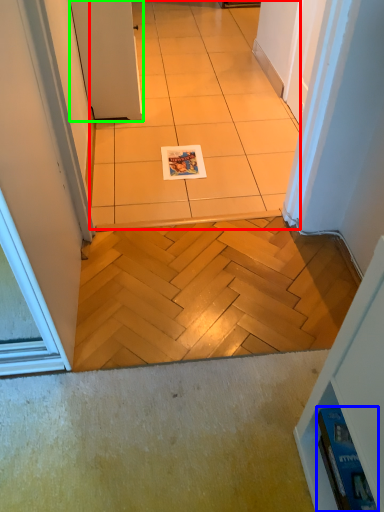
Question: Considering the real-world distances, which object is farthest from ceramic tile (highlighted by a red box)? magazine (highlighted by a blue box) or door (highlighted by a green box)?

Choices:
 (A) magazine
 (B) door

Answer: (A)